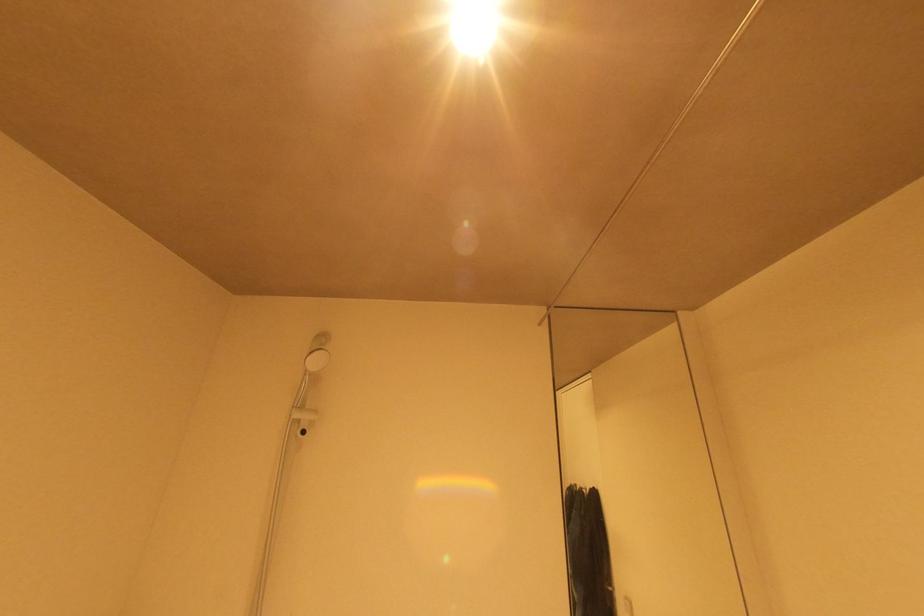
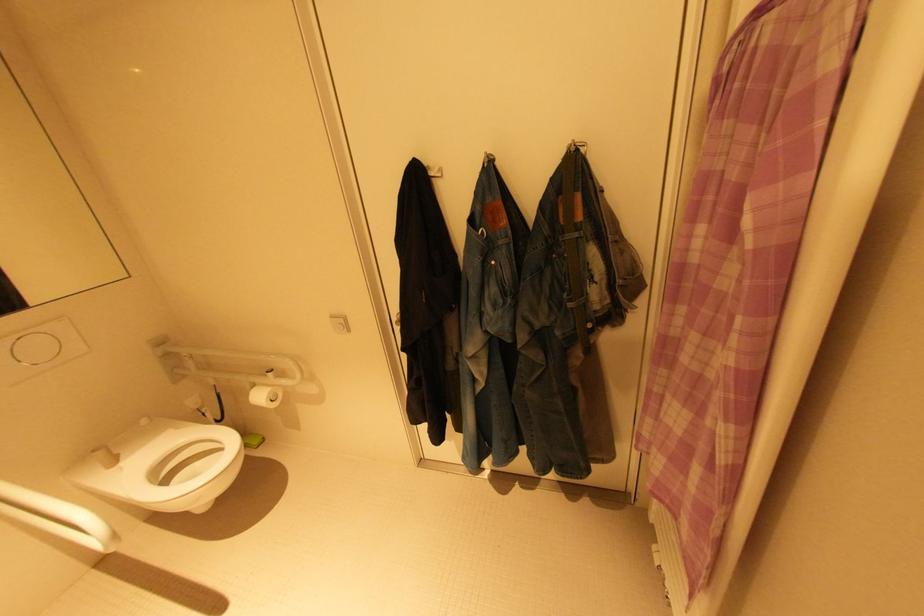
How did the camera likely rotate?

The camera rotated toward right-down.